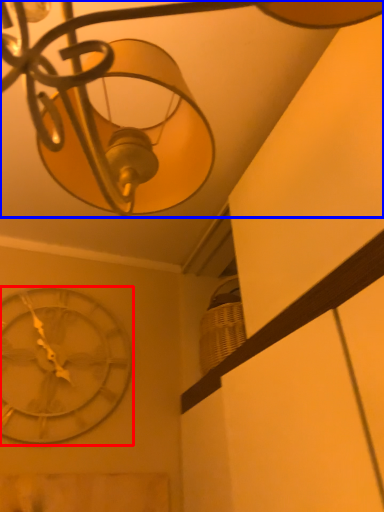
Question: Which object appears farthest to the camera in this image, wall clock (highlighted by a red box) or lamp (highlighted by a blue box)?

Choices:
 (A) wall clock
 (B) lamp

Answer: (A)